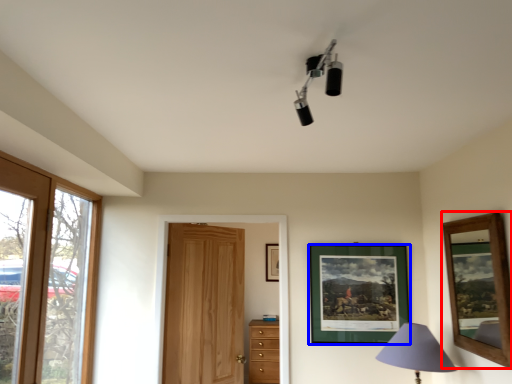
Question: Which object appears closest to the camera in this image, picture frame (highlighted by a red box) or picture frame (highlighted by a blue box)?

Choices:
 (A) picture frame
 (B) picture frame

Answer: (A)